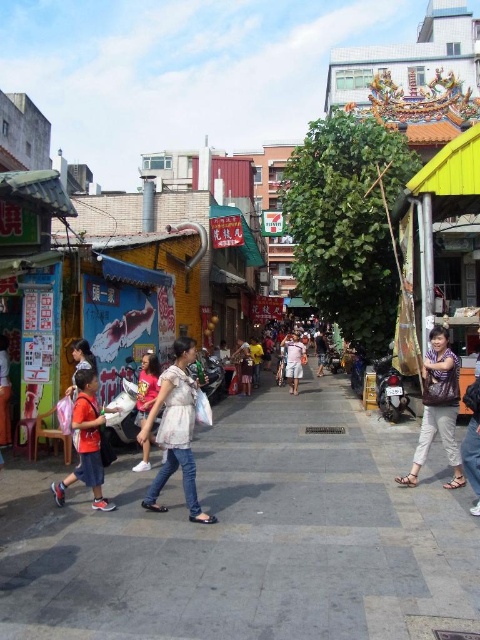
You are a tailor who needs to determine which shirt requires more fabric for alterations. Based on the scene, which shirt between the patterned fabric shirt at right and the pink cotton shirt at center would need more fabric?

The patterned fabric shirt at right requires more fabric because its width is larger than the pink cotton shirt at center.

You are a delivery person carrying a package and need to navigate through the street. You see a matte red backpack at left and light blue denim shorts at center. Which object is closer to the ground?

The matte red backpack at left is located below light blue denim shorts at center, so it is closer to the ground.